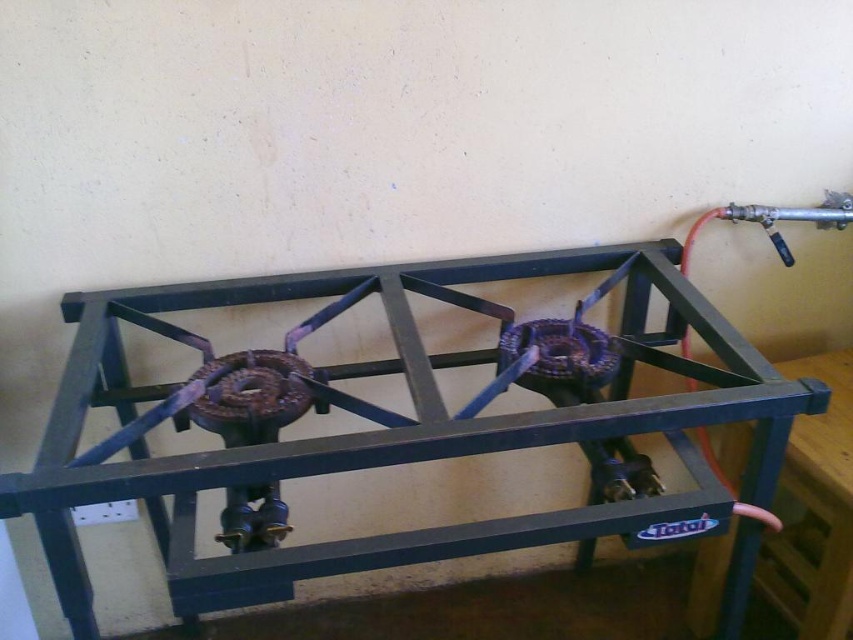
You are standing in front of the black metal gas stove at center and want to place a pot on the metallic blue table at right. Which object is closer to you so you can reach it first?

The black metal gas stove at center is closer to the viewer than the metallic blue table at right, so you can reach it first.

You are a chef who needs to move a pot from the black metal gas stove at center to the metallic blue table at right. Can you do this without needing to step back to avoid the stove?

The black metal gas stove at center and metallic blue table at right are 40.41 centimeters apart. Since the distance between them is sufficient to move a pot without needing extra space, you can move the pot without stepping back.

You are setting up a kitchen layout and want to place the black metal gas stove at center and the metallic blue table at right. Considering their sizes, which object should be placed closer to the wall to save space?

The metallic blue table at right should be placed closer to the wall since it is smaller than the black metal gas stove at center, allowing for better space utilization.